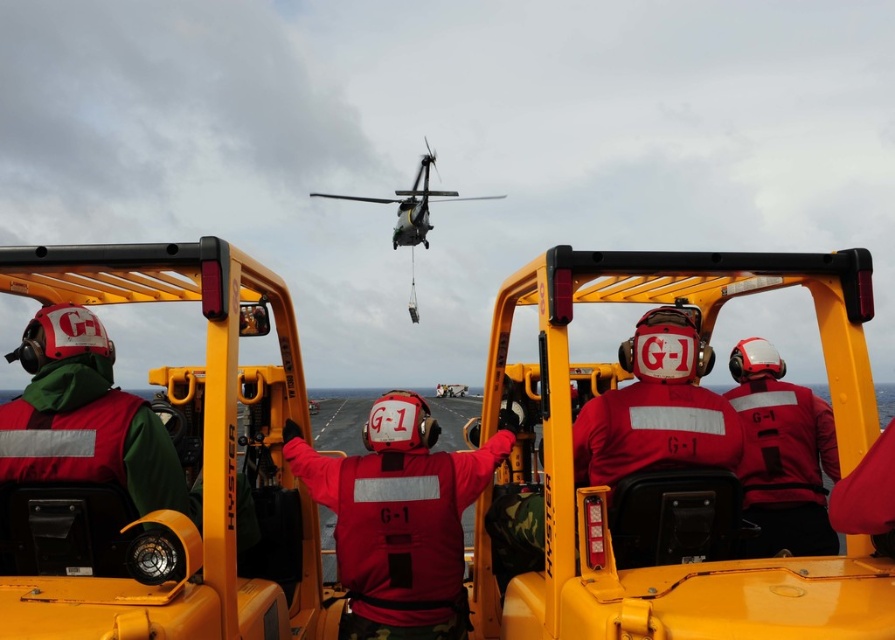
In the scene shown: You are a safety inspector evaluating the layout of the rescue operation. Given the red matte jacket at center and the metallic gray helicopter at upper center, which object takes up more area in the scene?

The metallic gray helicopter at upper center takes up more area in the scene than the red matte jacket at center, as the red matte jacket at center occupies less space than the metallic gray helicopter at upper center.

You are a safety inspector reviewing the equipment of the workers in the image. You notice two items at the center of the scene labeled as the red matte jacket at center and the red matte helmet at center. According to safety regulations, the helmet must be larger than the jacket to ensure proper coverage. Does the current setup comply with this requirement?

The red matte jacket at center has a smaller size compared to the red matte helmet at center, so the setup complies with the safety regulation requiring the helmet to be larger than the jacket for proper coverage.

You are a safety inspector checking the equipment of the workers in the scene. You notice both the red matte jacket at center and the red matte helmet at center. Which item is wider in terms of physical dimensions?

The red matte jacket at center is wider than the red matte helmet at center according to the description provided.